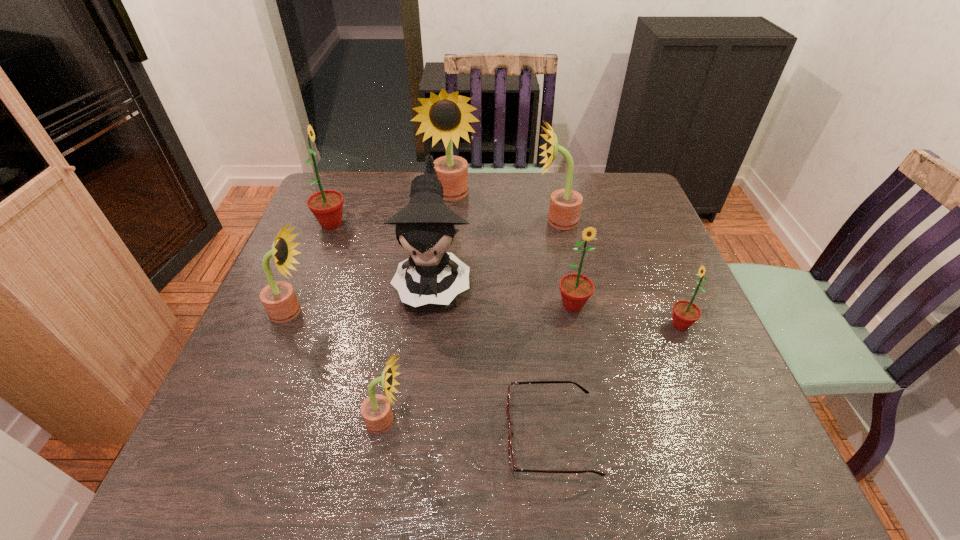
Locate an element on the screen. sunflower at the near edge is located at coordinates (376, 411).

Find the location of `spectacles at the near edge`. spectacles at the near edge is located at coordinates (513, 468).

Image resolution: width=960 pixels, height=540 pixels. What are the coordinates of `object located in the right edge section of the desktop` in the screenshot? It's located at (685, 313).

Where is `object at the far left corner`? This screenshot has height=540, width=960. object at the far left corner is located at coordinates (327, 205).

The height and width of the screenshot is (540, 960). Identify the location of vacant region at the far edge of the desktop. (545, 178).

Where is `vacant region at the near edge`? vacant region at the near edge is located at coordinates (401, 482).

The image size is (960, 540). I want to click on vacant space at the left edge of the desktop, so click(x=324, y=241).

Identify the location of vacant space at the right edge. (656, 230).

This screenshot has height=540, width=960. In the image, there is a desktop. In order to click on free space at the far right corner in this screenshot , I will do `click(629, 196)`.

This screenshot has height=540, width=960. I want to click on unoccupied position between the biggest yellow sunflower and the second nearest yellow sunflower, so click(372, 254).